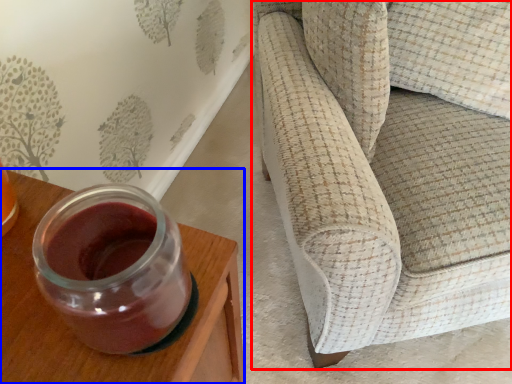
Question: Among these objects, which one is nearest to the camera, studio couch (highlighted by a red box) or furniture (highlighted by a blue box)?

Choices:
 (A) studio couch
 (B) furniture

Answer: (B)